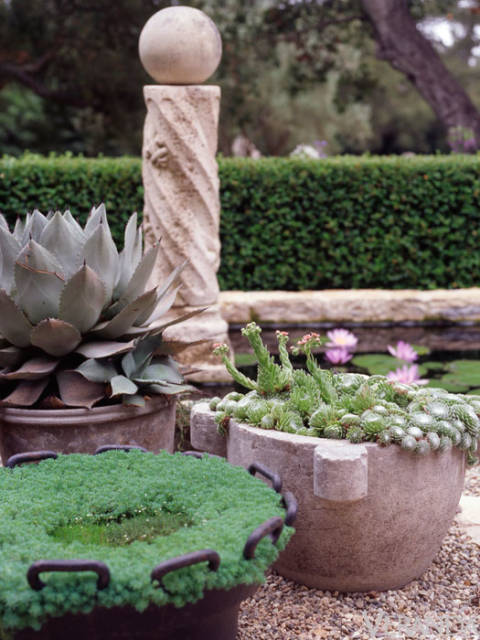
This screenshot has width=480, height=640. Identify the location of base of pillar. (207, 349).